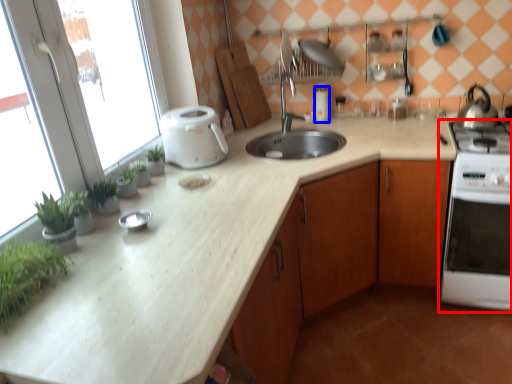
Question: Among these objects, which one is nearest to the camera, home appliance (highlighted by a red box) or appliance (highlighted by a blue box)?

Choices:
 (A) home appliance
 (B) appliance

Answer: (A)